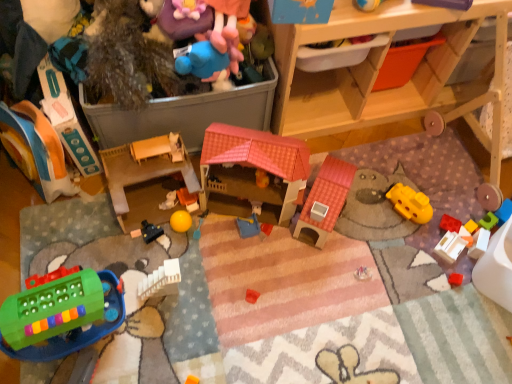
Locate an element on the screen. This screenshot has height=384, width=512. vacant area that lies between translucent orange cube at center, the 3th toy in the right-to-left sequence, and blue plastic toy at center, which is the fifth toy from right to left is located at coordinates (348, 239).